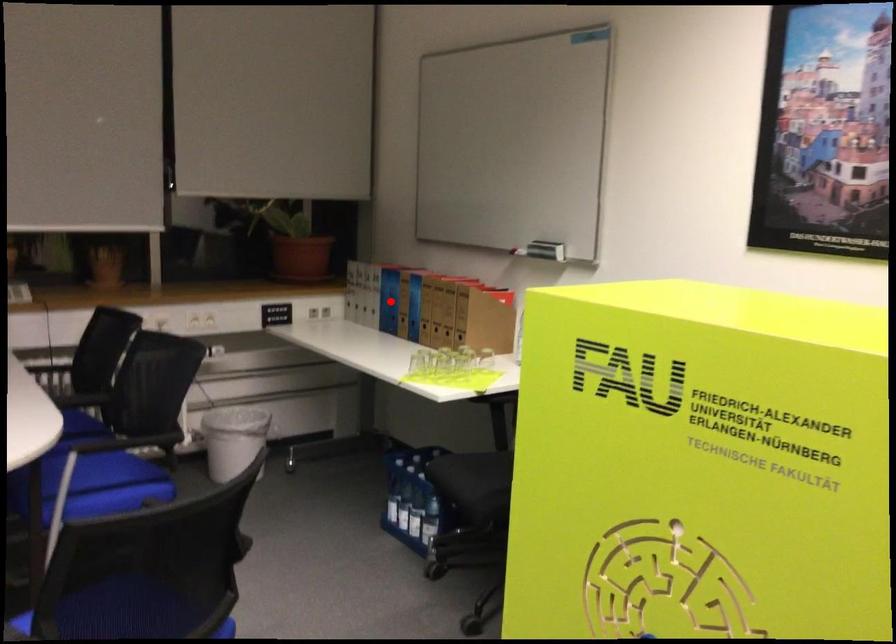
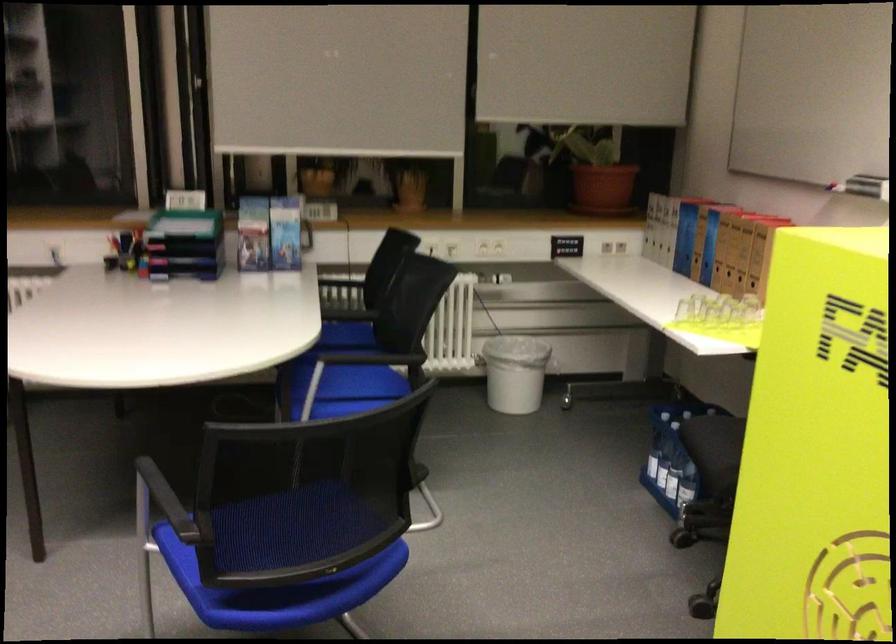
The point at the highlighted location is marked in the first image. Where is the corresponding point in the second image?

(685, 238)